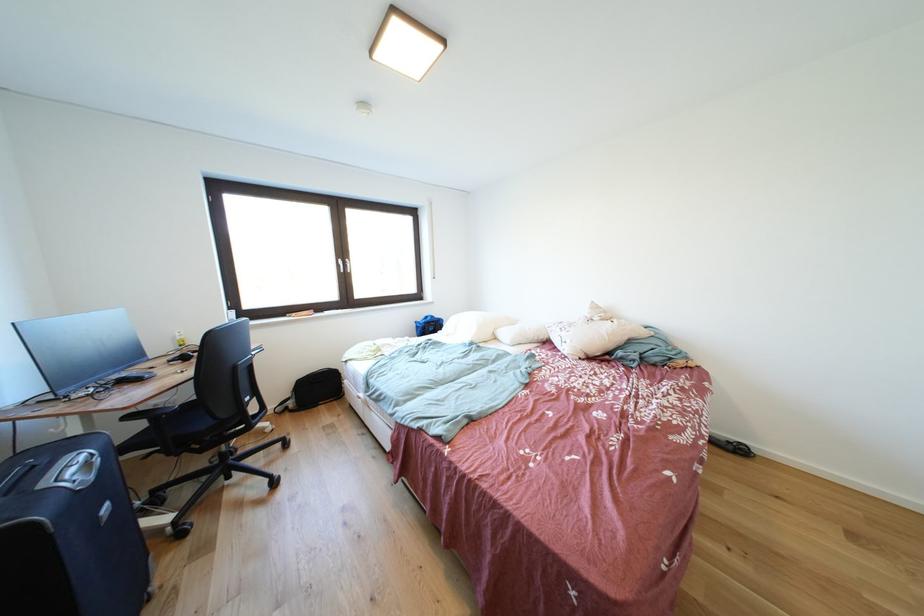
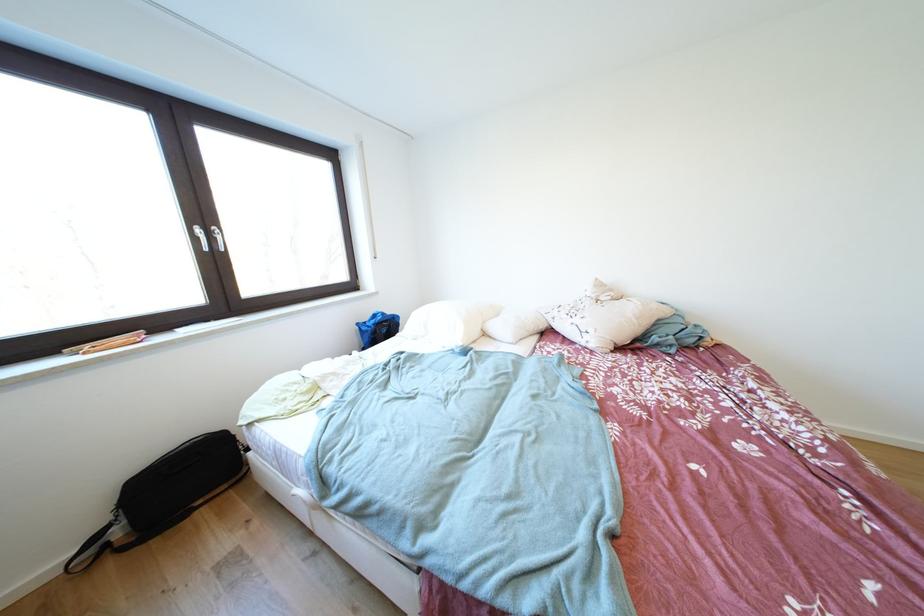
Find the pixel in the second image that matches point (302, 318) in the first image.

(95, 351)